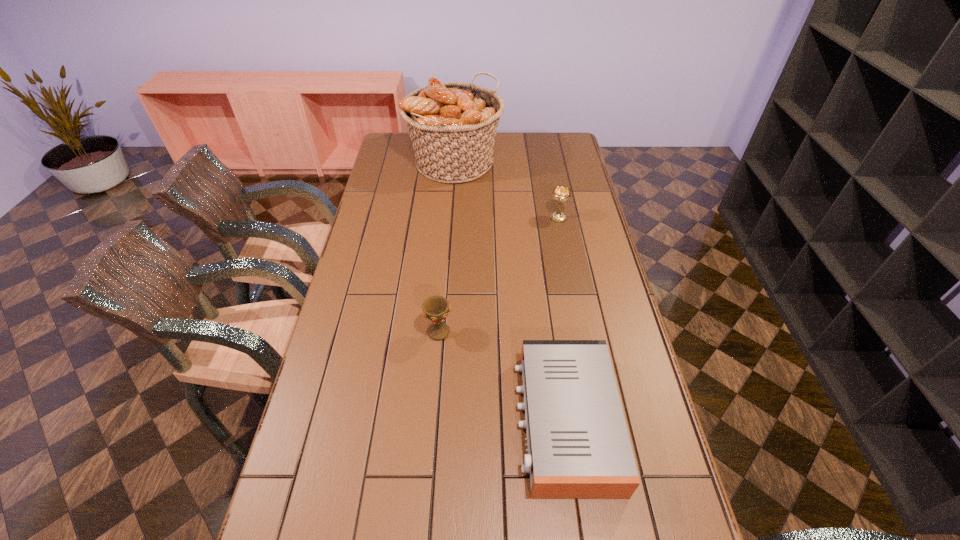
Find the location of a particular element. The width and height of the screenshot is (960, 540). basket is located at coordinates (452, 125).

Locate an element on the screen. the farthest object is located at coordinates (452, 125).

The width and height of the screenshot is (960, 540). In order to click on the second farthest object in this screenshot , I will do click(561, 194).

I want to click on the farther chalice, so click(561, 194).

You are a GUI agent. You are given a task and a screenshot of the screen. Output one action in this format:
    pyautogui.click(x=<x>, y=<y>)
    Task: Click on the third farthest object
    This screenshot has height=540, width=960.
    Given the screenshot: What is the action you would take?
    pyautogui.click(x=436, y=308)

The image size is (960, 540). I want to click on the nearer chalice, so click(436, 308).

This screenshot has width=960, height=540. In order to click on radio receiver in this screenshot , I will do `click(578, 445)`.

Where is `the shortest object`? the shortest object is located at coordinates (578, 445).

The height and width of the screenshot is (540, 960). I want to click on blank area located on the right of the tallest object, so click(545, 163).

The height and width of the screenshot is (540, 960). Find the location of `vacant space positioned on the front of the second farthest object`. vacant space positioned on the front of the second farthest object is located at coordinates click(x=572, y=288).